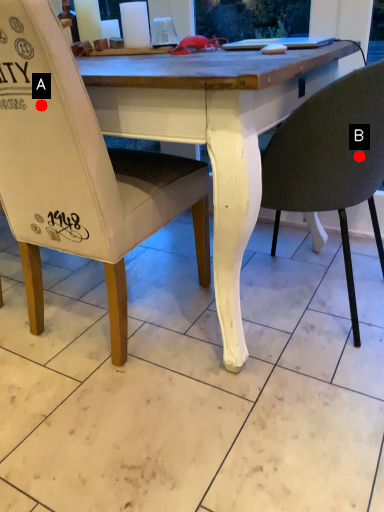
Question: Two points are circled on the image, labeled by A and B beside each circle. Which of the following is the farthest from the observer?

Choices:
 (A) A is further
 (B) B is further

Answer: (B)